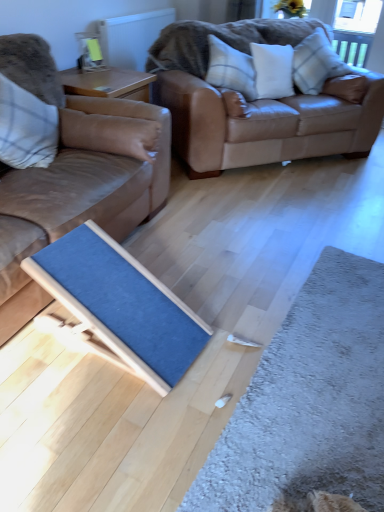
Question: Is point (26, 244) closer or farther from the camera than point (114, 147)?

Choices:
 (A) farther
 (B) closer

Answer: (B)

Question: Considering the relative positions of matte brown leather couch at left, positioned as the second studio couch in right-to-left order, and plaid fabric pillow at left, acting as the first pillow starting from the left, in the image provided, is matte brown leather couch at left, positioned as the second studio couch in right-to-left order, to the left or to the right of plaid fabric pillow at left, acting as the first pillow starting from the left,?

Choices:
 (A) right
 (B) left

Answer: (B)

Question: Estimate the real-world distances between objects in this image. Which object is farther from the matte brown leather couch at left, which is the 1th studio couch in left-to-right order?

Choices:
 (A) plaid fabric pillow at upper right, which is the fourth pillow in left-to-right order
 (B) blue fabric doormat at center, which is the first doormat from left to right
 (C) plaid fabric pillow at left, which is the fourth pillow from right to left
 (D) clear glass window screen at upper right
 (E) white fabric pillow at upper center, the second pillow viewed from the right

Answer: (D)

Question: Which of these objects is positioned closest to the clear glass window screen at upper right?

Choices:
 (A) white fabric pillow at upper center, the third pillow from the left
 (B) plaid fabric pillow at upper right, which is the fourth pillow in left-to-right order
 (C) blue fabric doormat at center, which is the first doormat from left to right
 (D) white textured radiator at upper center
 (E) plaid fabric pillow at left, acting as the first pillow starting from the left

Answer: (B)